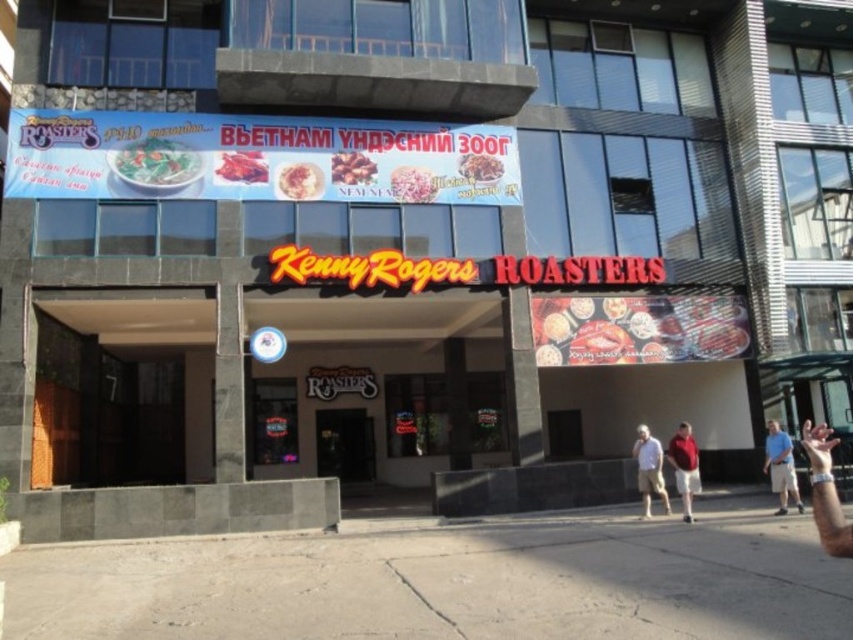
Question: Considering the relative positions of red fabric shirt at lower right and smooth white rice at center in the image provided, where is red fabric shirt at lower right located with respect to smooth white rice at center?

Choices:
 (A) above
 (B) below

Answer: (B)

Question: Can you confirm if shiny plastic food at center is thinner than smooth white rice at center?

Choices:
 (A) yes
 (B) no

Answer: (B)

Question: Among these objects, which one is farthest from the camera?

Choices:
 (A) brown matte food at center
 (B) red fabric shirt at lower right
 (C) black glass door at center

Answer: (C)

Question: Where is white glossy rice at center located in relation to brown matte food at center in the image?

Choices:
 (A) left
 (B) right

Answer: (B)

Question: Which object appears closest to the camera in this image?

Choices:
 (A) golden crispy chicken at center
 (B) white glossy rice at center
 (C) light beige shorts at center

Answer: (C)

Question: Which point is farther to the camera?

Choices:
 (A) brown matte food at center
 (B) blue denim shorts at lower right
 (C) green leafy salad at upper left

Answer: (A)